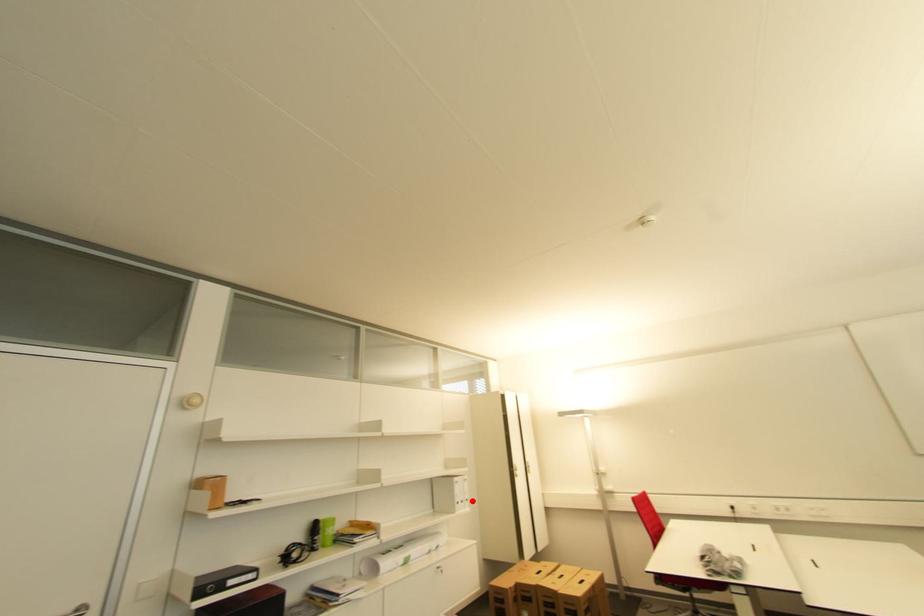
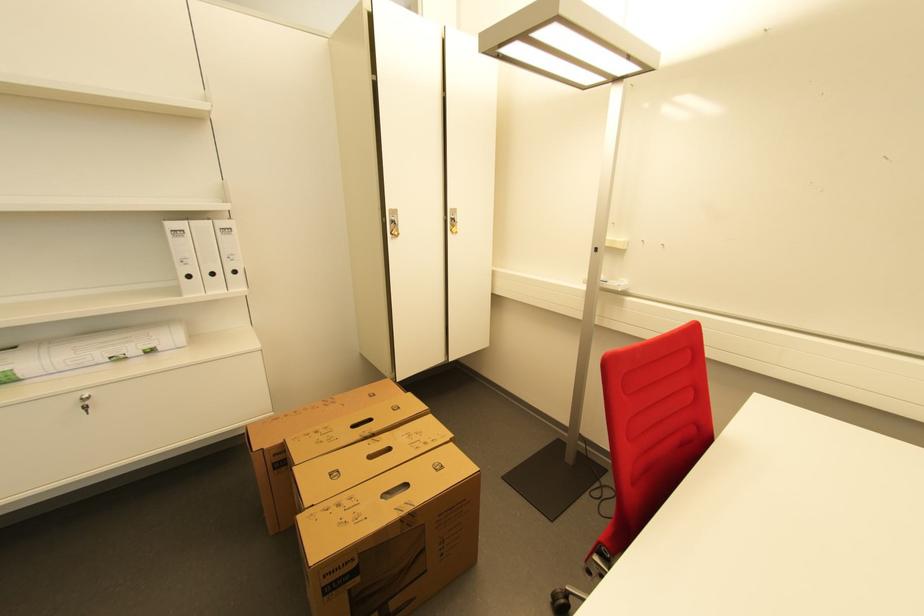
Where in the second image is the point corresponding to the highlighted location from the first image?

(239, 273)